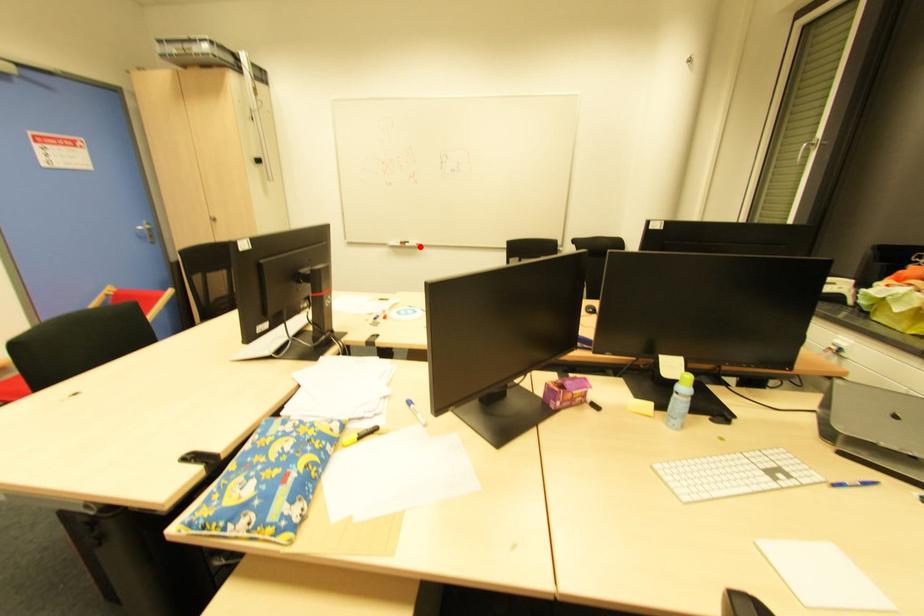
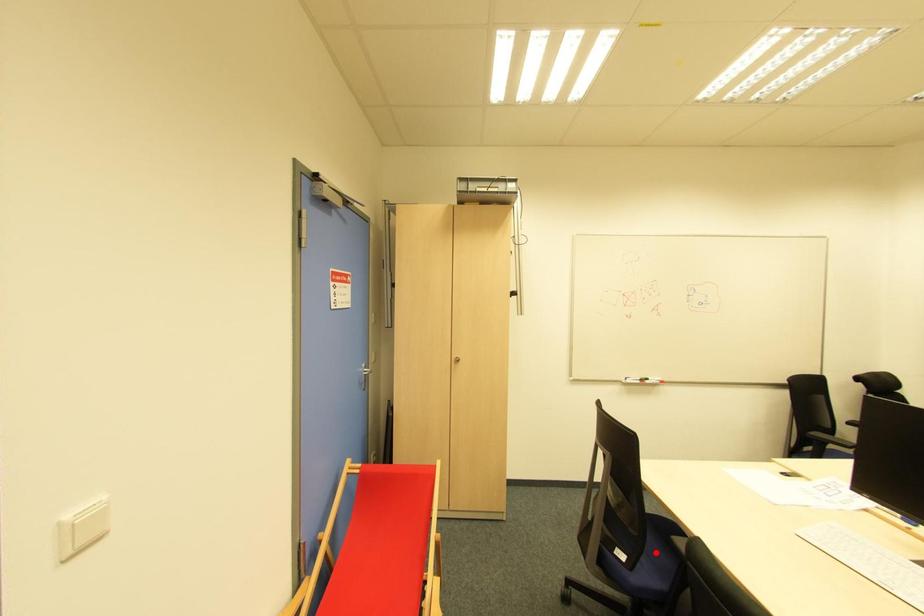
I am providing you with two images of the same scene from different viewpoints. A red point is marked on the first image and another point is marked on the second image. Do the highlighted points in image1 and image2 indicate the same real-world spot?

No